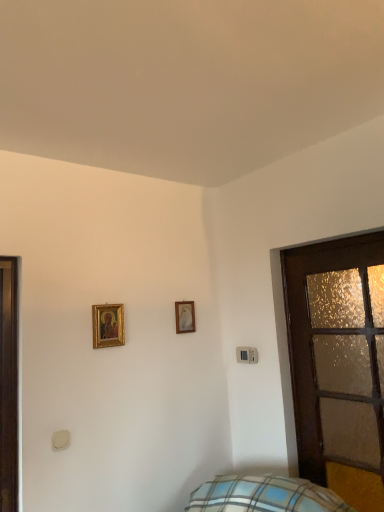
Question: Can you confirm if gold-framed picture at upper left, the 2th picture frame positioned from the right, is smaller than gold-framed picture at upper center, which is counted as the first picture frame, starting from the back?

Choices:
 (A) no
 (B) yes

Answer: (A)

Question: From a real-world perspective, does gold-framed picture at upper left, placed as the 2th picture frame when sorted from back to front, stand above gold-framed picture at upper center, the 1th picture frame in the right-to-left sequence?

Choices:
 (A) yes
 (B) no

Answer: (B)

Question: From the image's perspective, would you say gold-framed picture at upper left, the 2th picture frame positioned from the right, is shown under gold-framed picture at upper center, the 1th picture frame in the right-to-left sequence?

Choices:
 (A) no
 (B) yes

Answer: (A)

Question: Is gold-framed picture at upper left, the 2th picture frame positioned from the right, facing towards gold-framed picture at upper center, which is counted as the first picture frame, starting from the back?

Choices:
 (A) yes
 (B) no

Answer: (B)

Question: Does gold-framed picture at upper left, which is the 1th picture frame from left to right, have a larger size compared to gold-framed picture at upper center, the 1th picture frame in the right-to-left sequence?

Choices:
 (A) no
 (B) yes

Answer: (B)

Question: Does gold-framed picture at upper left, placed as the 2th picture frame when sorted from back to front, have a greater height compared to gold-framed picture at upper center, the 1th picture frame in the right-to-left sequence?

Choices:
 (A) yes
 (B) no

Answer: (A)

Question: Does gold-framed picture at upper left, the 2th picture frame positioned from the right, lie behind wooden frosted glass door at right?

Choices:
 (A) yes
 (B) no

Answer: (A)

Question: Is gold-framed picture at upper left, the 2th picture frame positioned from the right, taller than wooden frosted glass door at right?

Choices:
 (A) no
 (B) yes

Answer: (A)

Question: Is gold-framed picture at upper left, which is the 1th picture frame from left to right, positioned beyond the bounds of wooden frosted glass door at right?

Choices:
 (A) no
 (B) yes

Answer: (B)

Question: Could you tell me if gold-framed picture at upper left, the 2th picture frame positioned from the right, is facing wooden frosted glass door at right?

Choices:
 (A) no
 (B) yes

Answer: (A)

Question: Can you confirm if gold-framed picture at upper left, which is the 1th picture frame from left to right, is shorter than wooden frosted glass door at right?

Choices:
 (A) yes
 (B) no

Answer: (A)

Question: Can you confirm if gold-framed picture at upper left, placed as the 2th picture frame when sorted from back to front, is smaller than wooden frosted glass door at right?

Choices:
 (A) no
 (B) yes

Answer: (B)

Question: Is wooden frosted glass door at right to the left of gold-framed picture at upper left, which is the 1th picture frame from left to right, from the viewer's perspective?

Choices:
 (A) yes
 (B) no

Answer: (B)